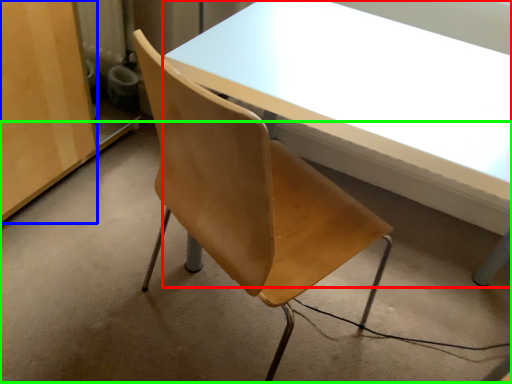
Question: Estimate the real-world distances between objects in this image. Which object is closer to table (highlighted by a red box), plywood (highlighted by a blue box) or concrete (highlighted by a green box)?

Choices:
 (A) plywood
 (B) concrete

Answer: (B)